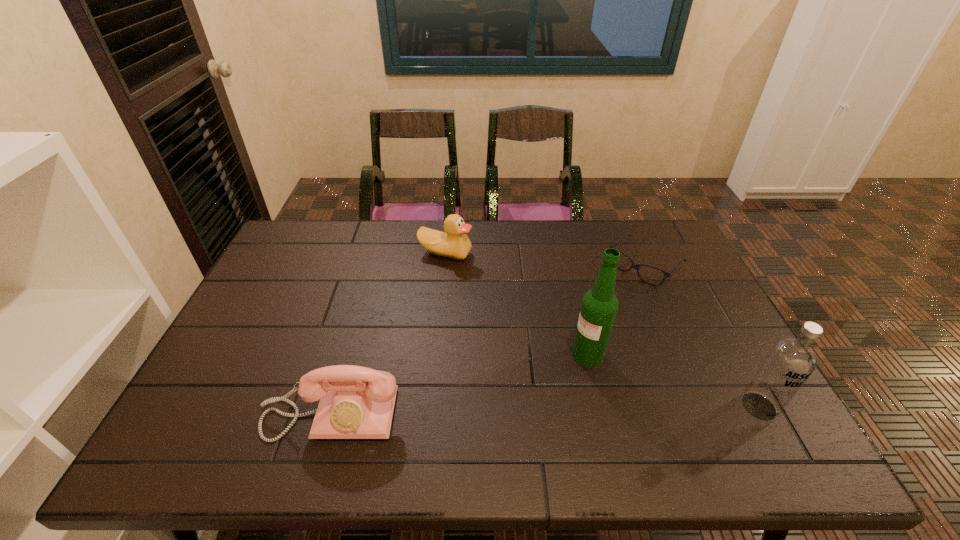
This screenshot has width=960, height=540. I want to click on vacant space located on the front-facing side of the shortest object, so click(610, 299).

Locate an element on the screen. The height and width of the screenshot is (540, 960). vacant space located 0.380m on the front-facing side of the shortest object is located at coordinates (554, 352).

Find the location of a particular element. The height and width of the screenshot is (540, 960). vacant area situated on the label of the beer bottle is located at coordinates (565, 374).

Image resolution: width=960 pixels, height=540 pixels. I want to click on free spot located on the label of the beer bottle, so click(x=518, y=414).

Find the location of a particular element. The width and height of the screenshot is (960, 540). vacant space located 0.210m on the label of the beer bottle is located at coordinates (521, 411).

Locate an element on the screen. The height and width of the screenshot is (540, 960). duck situated at the far edge is located at coordinates (454, 243).

You are a GUI agent. You are given a task and a screenshot of the screen. Output one action in this format:
    pyautogui.click(x=<x>, y=<y>)
    Task: Click on the spectacles at the far edge
    The width and height of the screenshot is (960, 540).
    Given the screenshot: What is the action you would take?
    click(636, 266)

The width and height of the screenshot is (960, 540). I want to click on telephone present at the near edge, so click(356, 402).

Where is `vodka present at the near edge`? vodka present at the near edge is located at coordinates (790, 361).

The height and width of the screenshot is (540, 960). Identify the location of vodka at the right edge. (790, 361).